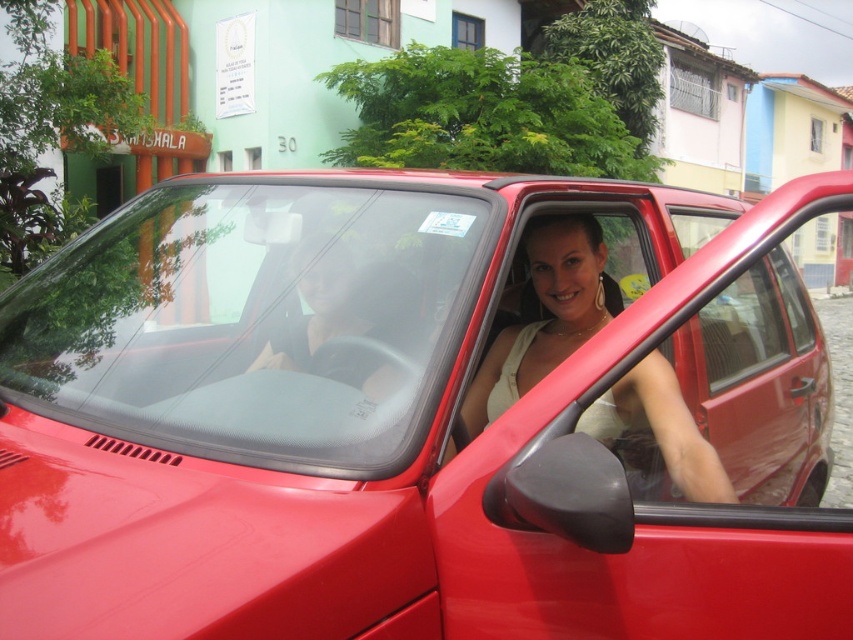
Question: Which object is the farthest from the glossy red car at center?

Choices:
 (A) matte black shirt at center
 (B) matte white dress at center
 (C) transparent glass windshield at center

Answer: (C)

Question: Does glossy red car at center appear over matte black shirt at center?

Choices:
 (A) yes
 (B) no

Answer: (B)

Question: Can you confirm if matte white dress at center is positioned above matte black shirt at center?

Choices:
 (A) yes
 (B) no

Answer: (B)

Question: Which point appears closest to the camera in this image?

Choices:
 (A) (244, 269)
 (B) (683, 472)
 (C) (315, 320)
 (D) (798, 186)

Answer: (D)

Question: Is matte white dress at center to the left of matte black shirt at center from the viewer's perspective?

Choices:
 (A) no
 (B) yes

Answer: (A)

Question: Estimate the real-world distances between objects in this image. Which object is closer to the matte white dress at center?

Choices:
 (A) glossy red car at center
 (B) transparent glass windshield at center
 (C) matte black shirt at center

Answer: (A)